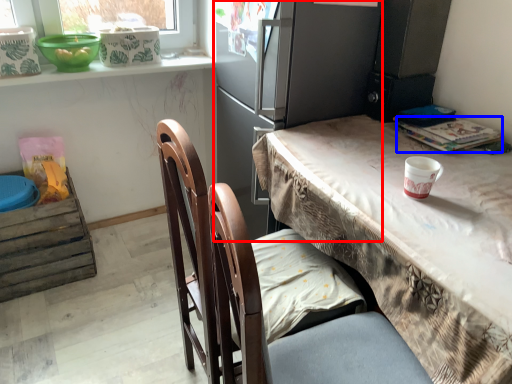
Question: Which of the following is the closest to the observer, fridge (highlighted by a red box) or magazine (highlighted by a blue box)?

Choices:
 (A) fridge
 (B) magazine

Answer: (A)